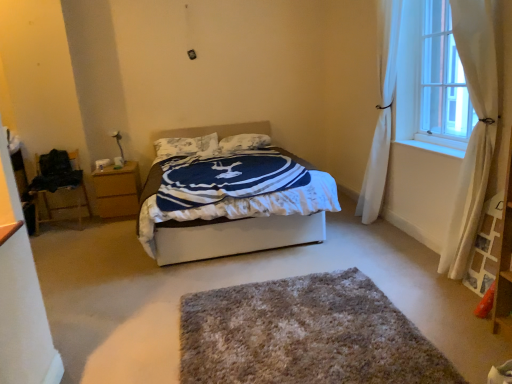
Where is `free space that is in between white sheer curtain at right, the first curtain positioned from the front, and shaggy gray rug at center`? free space that is in between white sheer curtain at right, the first curtain positioned from the front, and shaggy gray rug at center is located at coordinates (389, 292).